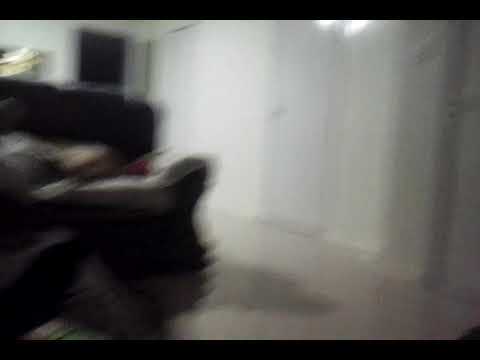
The width and height of the screenshot is (480, 360). In order to click on door handle in this screenshot , I will do pyautogui.click(x=277, y=110).